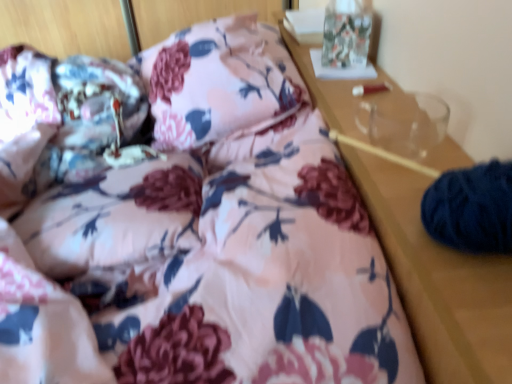
You are a GUI agent. You are given a task and a screenshot of the screen. Output one action in this format:
    pyautogui.click(x=<x>, y=<y>)
    Task: Click on the dark blue yarn at right, positioned as the first pillow in front-to-back order
    
    Given the screenshot: What is the action you would take?
    pyautogui.click(x=471, y=208)

Describe the element at coordinates (471, 208) in the screenshot. I see `dark blue yarn at right, the first pillow positioned from the bottom` at that location.

Measure the distance between point (194, 44) and camera.

The depth of point (194, 44) is 95.20 centimeters.

Identify the location of floral fabric pillow at center, the 1th pillow when ordered from left to right. (217, 81).

What do you see at coordinates (217, 81) in the screenshot? I see `floral fabric pillow at center, which appears as the 1th pillow when viewed from the back` at bounding box center [217, 81].

At what (x,y) coordinates should I click in order to perform the action: click on dark blue yarn at right, positioned as the first pillow in front-to-back order. Please return your answer as a coordinate pair (x, y). The height and width of the screenshot is (384, 512). Looking at the image, I should click on (471, 208).

Which is more to the left, floral fabric pillow at center, the 1th pillow when ordered from left to right, or dark blue yarn at right, positioned as the first pillow in front-to-back order?

From the viewer's perspective, floral fabric pillow at center, the 1th pillow when ordered from left to right, appears more on the left side.

Consider the image. Considering the positions of objects floral fabric pillow at center, arranged as the 2th pillow when viewed from the right, and dark blue yarn at right, the second pillow from the back, in the image provided, who is behind, floral fabric pillow at center, arranged as the 2th pillow when viewed from the right, or dark blue yarn at right, the second pillow from the back,?

floral fabric pillow at center, arranged as the 2th pillow when viewed from the right, is more distant.

Between point (206, 78) and point (458, 215), which one is positioned behind?

The point (206, 78) is farther.

From the picture: From the image's perspective, is floral fabric pillow at center, which appears as the 1th pillow when viewed from the back, located above or below dark blue yarn at right, the second pillow from the back?

floral fabric pillow at center, which appears as the 1th pillow when viewed from the back, is above dark blue yarn at right, the second pillow from the back.

In the scene shown: From a real-world perspective, does floral fabric pillow at center, arranged as the 2th pillow when viewed from the front, sit lower than dark blue yarn at right, positioned as the first pillow in right-to-left order?

Yes.

Between floral fabric pillow at center, the 2th pillow from the bottom, and dark blue yarn at right, the 2th pillow from the left, which one has larger width?

floral fabric pillow at center, the 2th pillow from the bottom, is wider.

Which of these two, floral fabric pillow at center, the 1th pillow when ordered from left to right, or dark blue yarn at right, positioned as the first pillow in front-to-back order, stands shorter?

dark blue yarn at right, positioned as the first pillow in front-to-back order.

Who is bigger, floral fabric pillow at center, marked as the first pillow in a top-to-bottom arrangement, or dark blue yarn at right, positioned as the first pillow in front-to-back order?

Bigger between the two is floral fabric pillow at center, marked as the first pillow in a top-to-bottom arrangement.

Is floral fabric pillow at center, the 2th pillow from the bottom, outside of dark blue yarn at right, positioned as the first pillow in front-to-back order?

Absolutely, floral fabric pillow at center, the 2th pillow from the bottom, is external to dark blue yarn at right, positioned as the first pillow in front-to-back order.

Can you see floral fabric pillow at center, marked as the first pillow in a top-to-bottom arrangement, touching dark blue yarn at right, positioned as the first pillow in right-to-left order?

No, floral fabric pillow at center, marked as the first pillow in a top-to-bottom arrangement, is not beside dark blue yarn at right, positioned as the first pillow in right-to-left order.

Could you tell me if floral fabric pillow at center, the 1th pillow when ordered from left to right, is turned towards dark blue yarn at right, the first pillow positioned from the bottom?

No, floral fabric pillow at center, the 1th pillow when ordered from left to right, does not turn towards dark blue yarn at right, the first pillow positioned from the bottom.

How different are the orientations of floral fabric pillow at center, marked as the first pillow in a top-to-bottom arrangement, and dark blue yarn at right, positioned as the first pillow in front-to-back order, in degrees?

floral fabric pillow at center, marked as the first pillow in a top-to-bottom arrangement, and dark blue yarn at right, positioned as the first pillow in front-to-back order, are facing 3.2 degrees away from each other.

Where is `pillow in front of the floral fabric pillow at center, the 2th pillow from the bottom`? The width and height of the screenshot is (512, 384). pillow in front of the floral fabric pillow at center, the 2th pillow from the bottom is located at coordinates (471, 208).

Which is more to the right, dark blue yarn at right, the second pillow viewed from the top, or floral fabric pillow at center, marked as the first pillow in a top-to-bottom arrangement?

Positioned to the right is dark blue yarn at right, the second pillow viewed from the top.

Between dark blue yarn at right, positioned as the first pillow in right-to-left order, and floral fabric pillow at center, arranged as the 2th pillow when viewed from the right, which one is positioned behind?

floral fabric pillow at center, arranged as the 2th pillow when viewed from the right, is more distant.

Between point (481, 248) and point (282, 54), which one is positioned in front?

Point (481, 248)

From the image's perspective, would you say dark blue yarn at right, positioned as the first pillow in front-to-back order, is positioned over floral fabric pillow at center, the 1th pillow when ordered from left to right?

No, from the image's perspective, dark blue yarn at right, positioned as the first pillow in front-to-back order, is not on top of floral fabric pillow at center, the 1th pillow when ordered from left to right.

From a real-world perspective, is dark blue yarn at right, the 2th pillow from the left, below floral fabric pillow at center, the 1th pillow when ordered from left to right?

No.

Considering the sizes of dark blue yarn at right, the second pillow from the back, and floral fabric pillow at center, arranged as the 2th pillow when viewed from the right, in the image, is dark blue yarn at right, the second pillow from the back, wider or thinner than floral fabric pillow at center, arranged as the 2th pillow when viewed from the right,?

Considering their sizes, dark blue yarn at right, the second pillow from the back, looks slimmer than floral fabric pillow at center, arranged as the 2th pillow when viewed from the right.

Considering the sizes of dark blue yarn at right, the second pillow viewed from the top, and floral fabric pillow at center, the 1th pillow when ordered from left to right, in the image, is dark blue yarn at right, the second pillow viewed from the top, taller or shorter than floral fabric pillow at center, the 1th pillow when ordered from left to right,?

In the image, dark blue yarn at right, the second pillow viewed from the top, appears to be shorter than floral fabric pillow at center, the 1th pillow when ordered from left to right.

Can you confirm if dark blue yarn at right, positioned as the first pillow in right-to-left order, is bigger than floral fabric pillow at center, the 1th pillow when ordered from left to right?

No, dark blue yarn at right, positioned as the first pillow in right-to-left order, is not bigger than floral fabric pillow at center, the 1th pillow when ordered from left to right.

Is dark blue yarn at right, the second pillow viewed from the top, outside of floral fabric pillow at center, the 1th pillow when ordered from left to right?

Yes, dark blue yarn at right, the second pillow viewed from the top, is not within floral fabric pillow at center, the 1th pillow when ordered from left to right.

Is dark blue yarn at right, the second pillow from the back, far from floral fabric pillow at center, arranged as the 2th pillow when viewed from the front?

No, dark blue yarn at right, the second pillow from the back, is not far away from floral fabric pillow at center, arranged as the 2th pillow when viewed from the front.

Is dark blue yarn at right, positioned as the first pillow in right-to-left order, aimed at floral fabric pillow at center, arranged as the 2th pillow when viewed from the front?

No, dark blue yarn at right, positioned as the first pillow in right-to-left order, does not turn towards floral fabric pillow at center, arranged as the 2th pillow when viewed from the front.

How different are the orientations of dark blue yarn at right, the 2th pillow from the left, and floral fabric pillow at center, marked as the first pillow in a top-to-bottom arrangement, in degrees?

They differ by 3.2 degrees in their facing directions.

Find the location of a particular element. Image resolution: width=512 pixels, height=384 pixels. pillow behind the dark blue yarn at right, the first pillow positioned from the bottom is located at coordinates (217, 81).

The image size is (512, 384). In order to click on pillow above the floral fabric pillow at center, which appears as the 1th pillow when viewed from the back (from a real-world perspective) in this screenshot , I will do `click(471, 208)`.

Where is `pillow below the floral fabric pillow at center, the 2th pillow from the bottom (from the image's perspective)`? This screenshot has height=384, width=512. pillow below the floral fabric pillow at center, the 2th pillow from the bottom (from the image's perspective) is located at coordinates (471, 208).